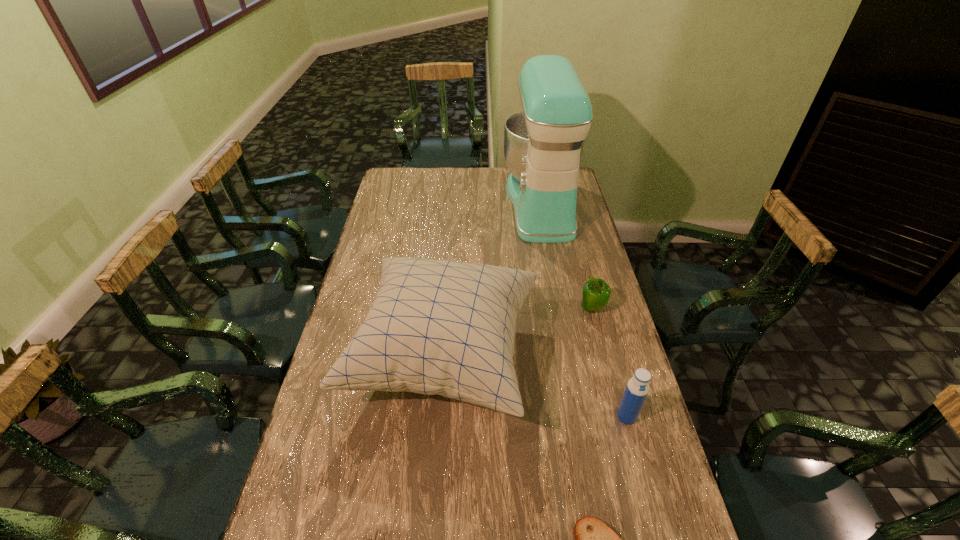
Locate an element on the screen. free space between the fourth tallest object and the farthest object is located at coordinates (566, 256).

This screenshot has height=540, width=960. I want to click on free space between the farthest object and the water bottle, so click(x=584, y=310).

Locate an element on the screen. Image resolution: width=960 pixels, height=540 pixels. blank region between the fifth shortest object and the third tallest object is located at coordinates (536, 386).

Where is `object that can be found as the closest to the fifth shortest object`? Image resolution: width=960 pixels, height=540 pixels. object that can be found as the closest to the fifth shortest object is located at coordinates (596, 293).

Where is `object that stands as the fourth closest to the third tallest object`? This screenshot has width=960, height=540. object that stands as the fourth closest to the third tallest object is located at coordinates (369, 539).

The image size is (960, 540). I want to click on vacant space that satisfies the following two spatial constraints: 1. at the base of the fourth shortest object; 2. on the left side of the farthest object, so click(581, 416).

The height and width of the screenshot is (540, 960). Identify the location of vacant area that satisfies the following two spatial constraints: 1. at the base of the third shortest object; 2. on the right side of the mixer. (561, 308).

The image size is (960, 540). Find the location of `free location that satisfies the following two spatial constraints: 1. at the base of the tallest object; 2. on the back side of the bell pepper`. free location that satisfies the following two spatial constraints: 1. at the base of the tallest object; 2. on the back side of the bell pepper is located at coordinates (561, 308).

I want to click on free region that satisfies the following two spatial constraints: 1. on the front side of the second tallest object; 2. on the left side of the water bottle, so click(x=440, y=416).